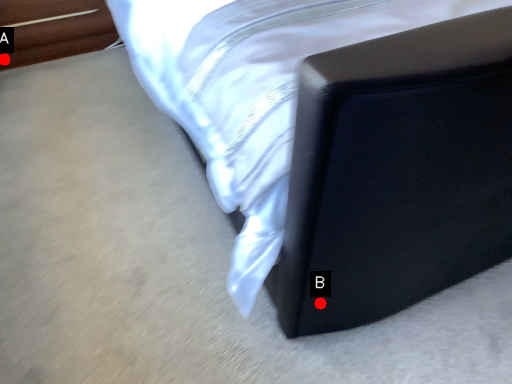
Question: Two points are circled on the image, labeled by A and B beside each circle. Which point appears farthest from the camera in this image?

Choices:
 (A) A is further
 (B) B is further

Answer: (A)